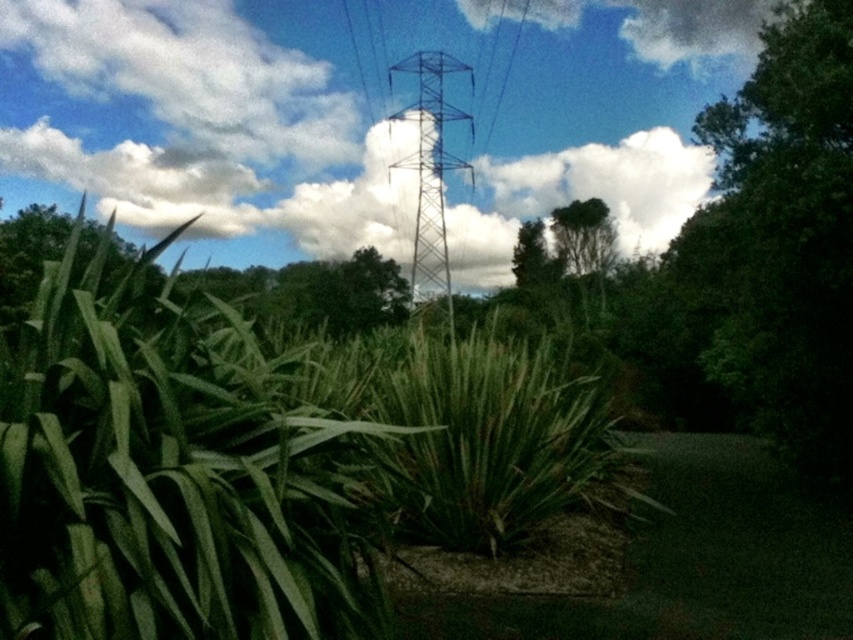
Question: Which point is farther to the camera?

Choices:
 (A) (560, 268)
 (B) (444, 294)

Answer: (A)

Question: Is metallic blue tower at center below green leafy tree at upper center?

Choices:
 (A) yes
 (B) no

Answer: (B)

Question: Where is metallic blue tower at center located in relation to green leafy tree at upper center in the image?

Choices:
 (A) below
 (B) above

Answer: (B)

Question: Is metallic blue tower at center thinner than green leafy tree at upper center?

Choices:
 (A) no
 (B) yes

Answer: (A)